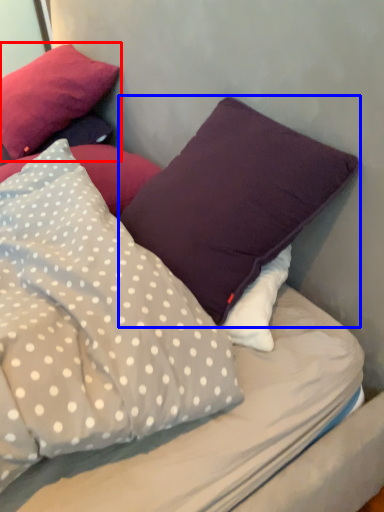
Question: Which point is closer to the camera, pillow (highlighted by a red box) or pillow (highlighted by a blue box)?

Choices:
 (A) pillow
 (B) pillow

Answer: (B)